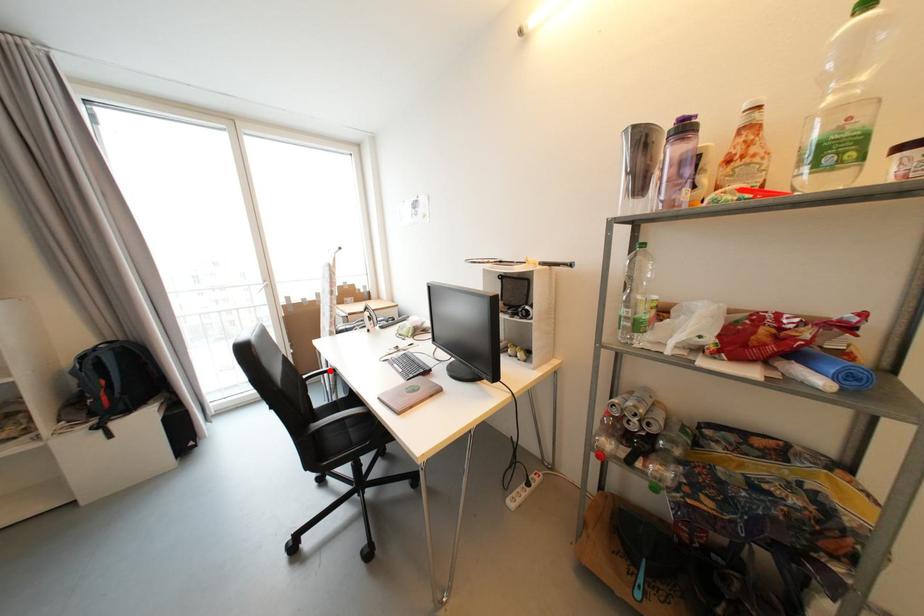
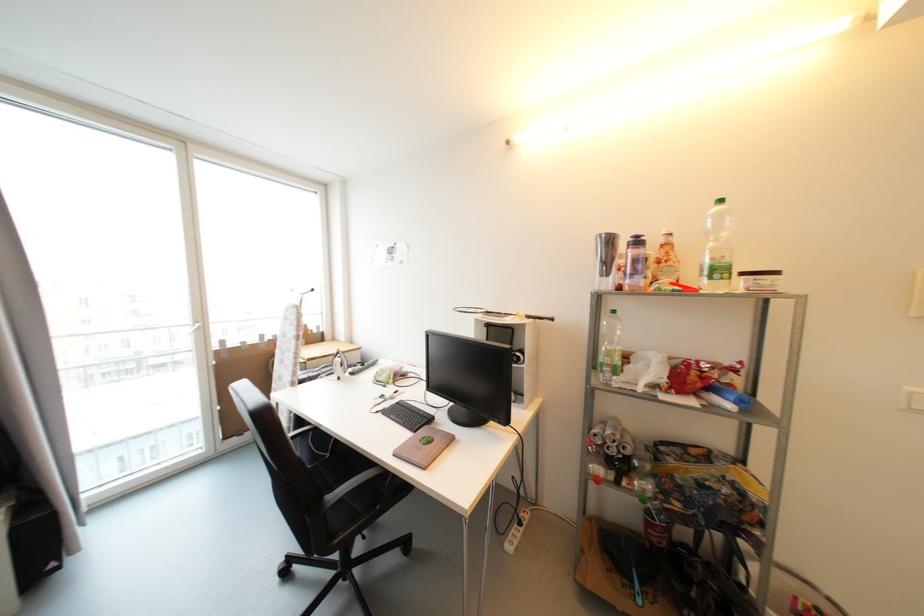
Question: I am providing you with two images of the same scene from different viewpoints. In image1, a red point is highlighted. Considering the same 3D point in image2, which of the following is correct?

Choices:
 (A) It is closer
 (B) It is farther

Answer: (A)